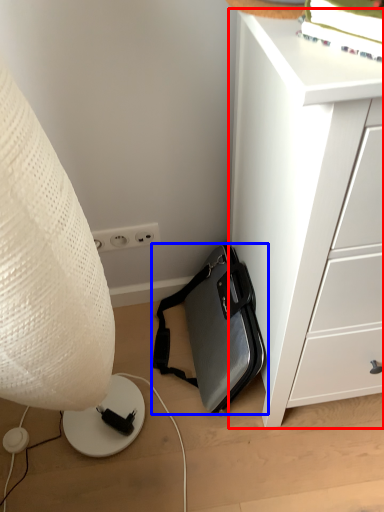
Question: Which object is closer to the camera taking this photo, chest of drawers (highlighted by a red box) or luggage and bags (highlighted by a blue box)?

Choices:
 (A) chest of drawers
 (B) luggage and bags

Answer: (A)